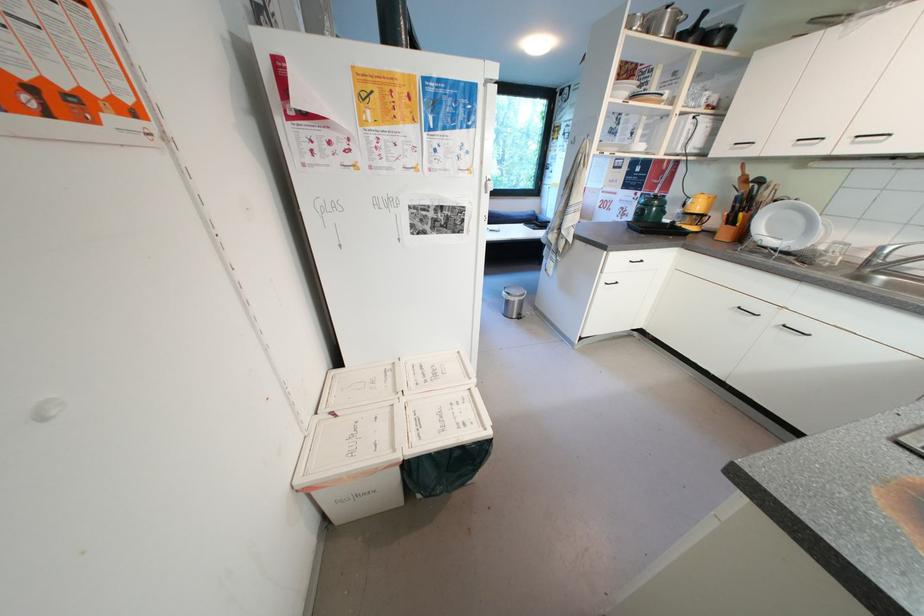
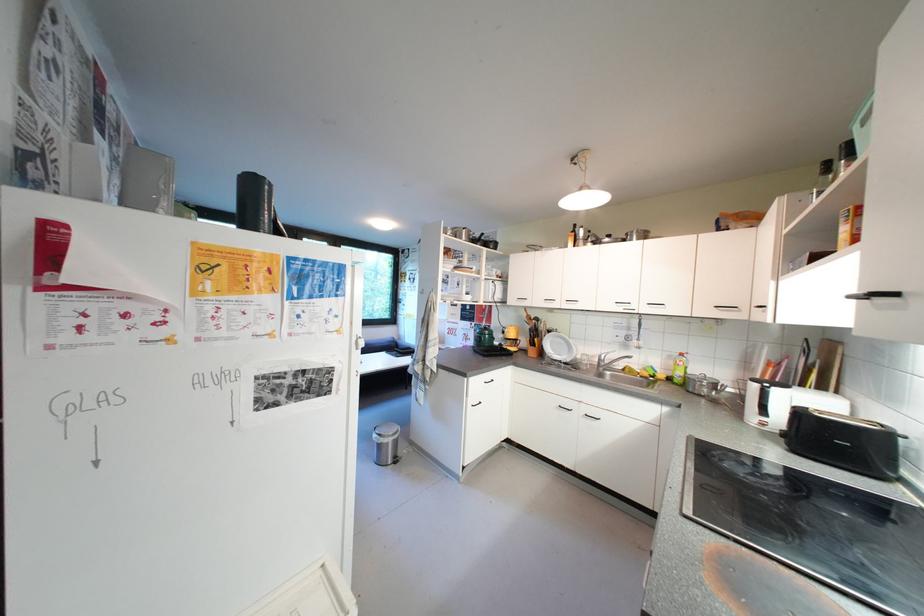
The point at (871, 252) is marked in the first image. Where is the corresponding point in the second image?

(602, 359)